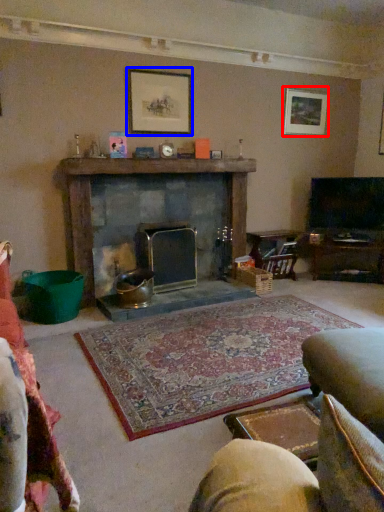
Question: Which object appears closest to the camera in this image, picture frame (highlighted by a red box) or picture frame (highlighted by a blue box)?

Choices:
 (A) picture frame
 (B) picture frame

Answer: (B)